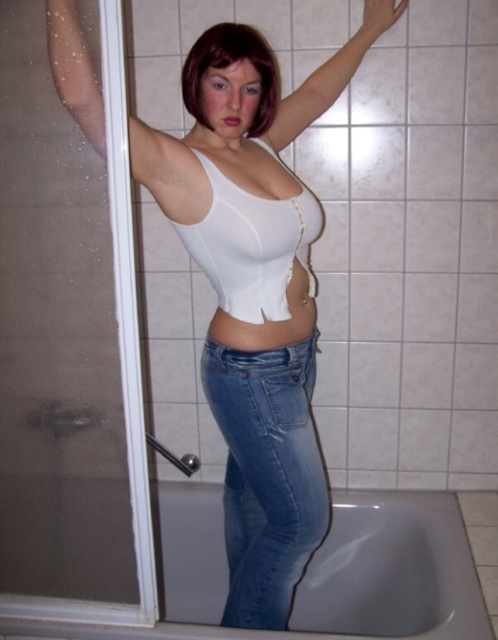
Is white glossy bathtub at lower center to the left of brushed metal grab bar at lower left from the viewer's perspective?

Incorrect, white glossy bathtub at lower center is not on the left side of brushed metal grab bar at lower left.

Is point (369, 611) farther from camera compared to point (172, 458)?

No, (369, 611) is in front of (172, 458).

This screenshot has width=498, height=640. I want to click on white glossy bathtub at lower center, so click(x=391, y=570).

Which is more to the left, white matte tank top at center or white matte arm at upper center?

Positioned to the left is white matte tank top at center.

You are a GUI agent. You are given a task and a screenshot of the screen. Output one action in this format:
    pyautogui.click(x=<x>, y=<y>)
    Task: Click on the white matte tank top at center
    The width and height of the screenshot is (498, 640).
    Given the screenshot: What is the action you would take?
    pyautogui.click(x=267, y=452)

I want to click on white glossy bathtub at lower center, so click(391, 570).

The height and width of the screenshot is (640, 498). What are the coordinates of `white glossy bathtub at lower center` in the screenshot? It's located at (391, 570).